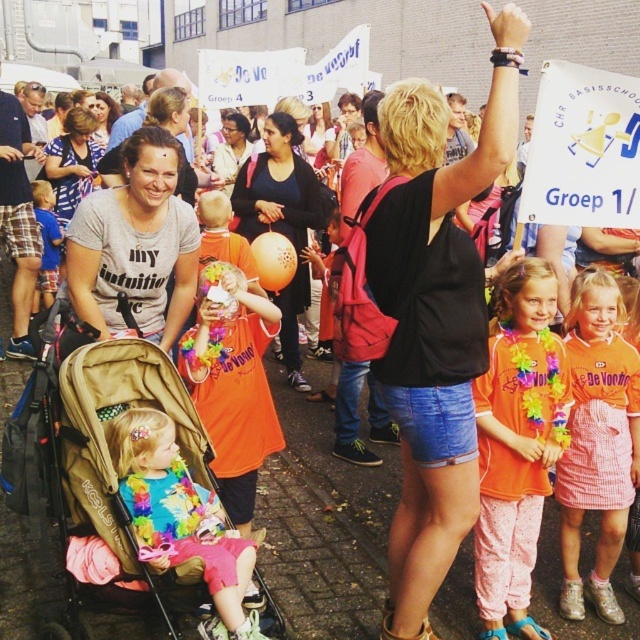
You are a photographer at the event and want to capture a photo of the matte pink pants at lower left without the beige fabric baby carriage at lower left appearing in the background. Can you do this by moving closer to the pants?

The beige fabric baby carriage at lower left is only 5.20 inches away from matte pink pants at lower left. Moving closer might not be enough to exclude the carriage from the frame since they are very close in proximity.

Looking at this image, you are a photographer at the event and want to take a picture of the crowd. You notice a point at coordinates (134, 244) in the image. What object is located at that point?

The point at coordinates (134, 244) is on the matte gray t shirt at center.